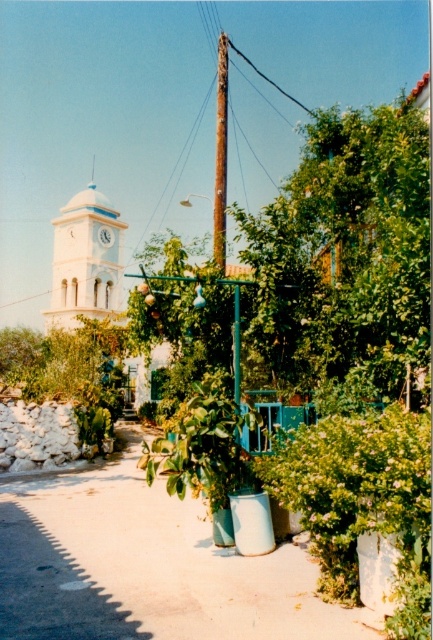
Question: Which of the following is the closest to the observer?

Choices:
 (A) matte white clock at center
 (B) rusty metal pole at center

Answer: (B)

Question: Can you confirm if white stucco clock tower at upper left is positioned above rusty metal pole at center?

Choices:
 (A) no
 (B) yes

Answer: (A)

Question: Among these objects, which one is farthest from the camera?

Choices:
 (A) green leafy tree at center
 (B) white stucco clock tower at upper left
 (C) matte white clock at center
 (D) rusty metal pole at center

Answer: (C)

Question: Is green leafy tree at center further to the viewer compared to matte white clock at center?

Choices:
 (A) yes
 (B) no

Answer: (B)

Question: Does white stucco clock tower at upper left have a lesser width compared to matte white clock at center?

Choices:
 (A) no
 (B) yes

Answer: (A)

Question: Which object is positioned farthest from the rusty metal pole at center?

Choices:
 (A) matte white clock at center
 (B) white stucco clock tower at upper left
 (C) green leafy tree at center

Answer: (A)